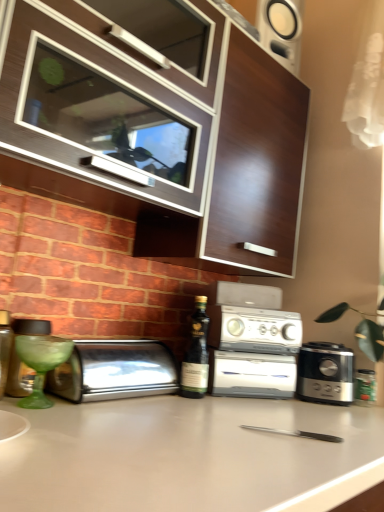
Question: Can you confirm if white plastic toaster oven at center is positioned to the right of matte brown bottle at left, the second bottle from the back?

Choices:
 (A) no
 (B) yes

Answer: (B)

Question: Is white plastic toaster oven at center bigger than matte brown bottle at left, the second bottle from the back?

Choices:
 (A) no
 (B) yes

Answer: (B)

Question: From the image's perspective, is white plastic toaster oven at center beneath matte brown bottle at left, the second bottle from the back?

Choices:
 (A) yes
 (B) no

Answer: (A)

Question: Does white plastic toaster oven at center touch matte brown bottle at left, the first bottle viewed from the top?

Choices:
 (A) no
 (B) yes

Answer: (A)

Question: Does white plastic toaster oven at center have a lesser height compared to matte brown bottle at left, the second bottle from the back?

Choices:
 (A) yes
 (B) no

Answer: (B)

Question: Does point click(x=266, y=244) appear closer or farther from the camera than point click(x=360, y=396)?

Choices:
 (A) closer
 (B) farther

Answer: (B)

Question: Is wooden cabinet at upper center taller or shorter than green glass jar at right, which is counted as the first bottle, starting from the right?

Choices:
 (A) tall
 (B) short

Answer: (A)

Question: Relative to green glass jar at right, which is counted as the 2th bottle, starting from the top, is wooden cabinet at upper center in front or behind?

Choices:
 (A) front
 (B) behind

Answer: (A)

Question: In the image, is wooden cabinet at upper center on the left side or the right side of green glass jar at right, which appears as the 1th bottle when viewed from the back?

Choices:
 (A) right
 (B) left

Answer: (B)

Question: From their relative heights in the image, would you say white matte countertop at center is taller or shorter than wooden cabinet at upper center?

Choices:
 (A) tall
 (B) short

Answer: (B)

Question: Looking at their shapes, would you say white matte countertop at center is wider or thinner than wooden cabinet at upper center?

Choices:
 (A) wide
 (B) thin

Answer: (A)

Question: Is white matte countertop at center situated inside wooden cabinet at upper center or outside?

Choices:
 (A) inside
 (B) outside

Answer: (B)

Question: Is white matte countertop at center in front of or behind wooden cabinet at upper center in the image?

Choices:
 (A) front
 (B) behind

Answer: (A)

Question: Relative to matte brown bottle at left, marked as the first bottle in a left-to-right arrangement, is dark green glass bottle at center in front or behind?

Choices:
 (A) front
 (B) behind

Answer: (B)

Question: Considering the positions of point (195, 353) and point (8, 331), is point (195, 353) closer or farther from the camera than point (8, 331)?

Choices:
 (A) closer
 (B) farther

Answer: (B)